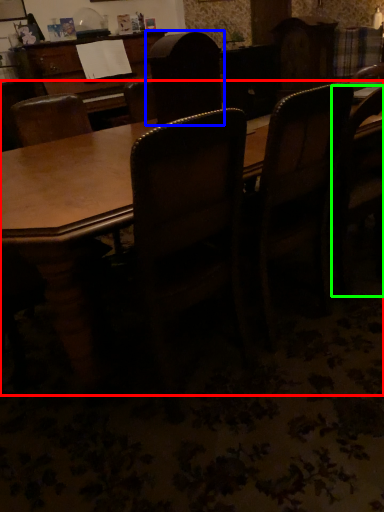
Question: Which is nearer to the table (highlighted by a red box)? chair (highlighted by a blue box) or chair (highlighted by a green box).

Choices:
 (A) chair
 (B) chair

Answer: (A)